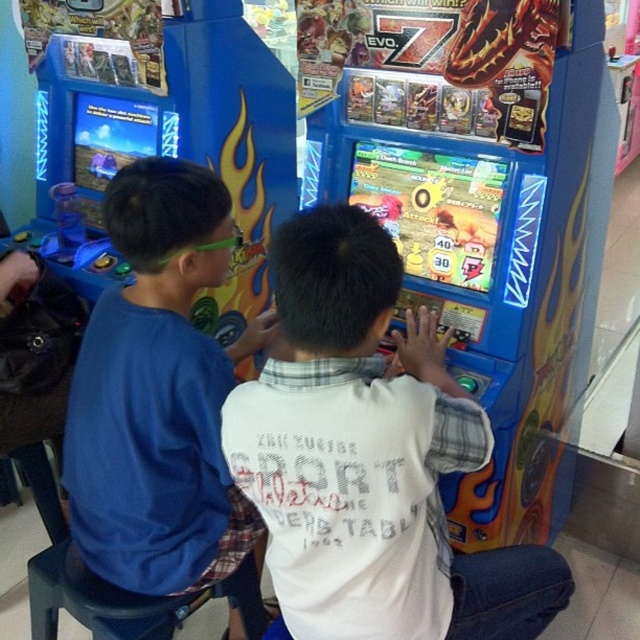
Which is above, blue plastic arcade game at center or blue cotton shirt at left?

blue plastic arcade game at center

The width and height of the screenshot is (640, 640). I want to click on blue plastic arcade game at center, so click(490, 252).

The image size is (640, 640). What are the coordinates of `blue plastic arcade game at center` in the screenshot? It's located at (490, 252).

The width and height of the screenshot is (640, 640). What do you see at coordinates (490, 252) in the screenshot?
I see `blue plastic arcade game at center` at bounding box center [490, 252].

Does point (474, 337) come farther from viewer compared to point (384, 464)?

Yes, it is behind point (384, 464).

Locate an element on the screen. blue plastic arcade game at center is located at coordinates (490, 252).

Between white cotton shirt at center and blue cotton shirt at left, which one is positioned lower?

Positioned lower is blue cotton shirt at left.

Does white cotton shirt at center appear over blue cotton shirt at left?

Yes, white cotton shirt at center is above blue cotton shirt at left.

The image size is (640, 640). What are the coordinates of `white cotton shirt at center` in the screenshot? It's located at (369, 456).